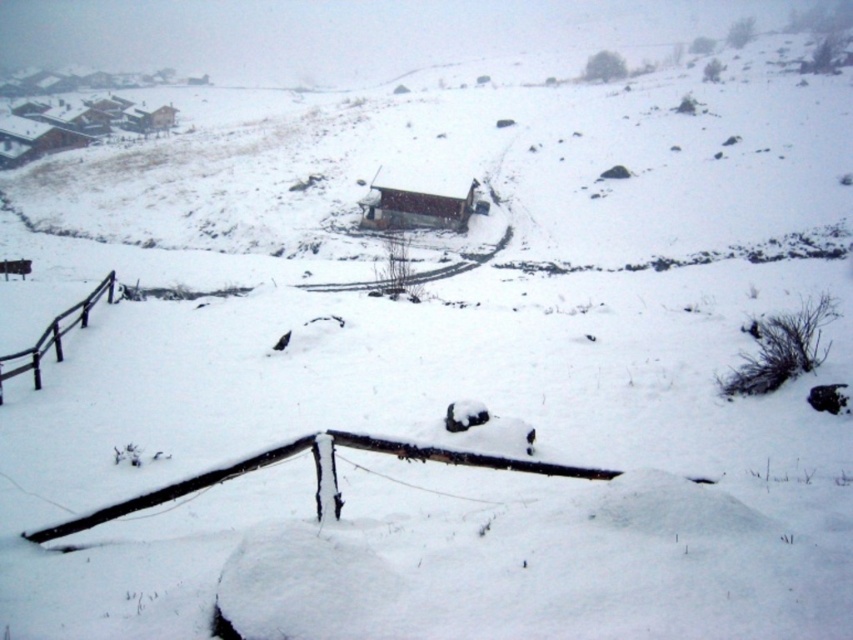
Question: Which of the following is the closest to the observer?

Choices:
 (A) black wood rail at left
 (B) snow-covered wood rail at lower center

Answer: (B)

Question: Is wooden cabin at center closer to the viewer compared to black wood rail at left?

Choices:
 (A) no
 (B) yes

Answer: (A)

Question: Does snow-covered wood rail at lower center have a smaller size compared to wooden cabin at center?

Choices:
 (A) yes
 (B) no

Answer: (A)

Question: Does snow-covered wood rail at lower center appear on the right side of wooden cabin at center?

Choices:
 (A) no
 (B) yes

Answer: (A)

Question: Which object is farther from the camera taking this photo?

Choices:
 (A) snow-covered wood rail at lower center
 (B) black wood rail at left
 (C) wooden cabin at center

Answer: (C)

Question: Which of these objects is positioned farthest from the wooden cabin at center?

Choices:
 (A) snow-covered wood rail at lower center
 (B) black wood rail at left

Answer: (A)